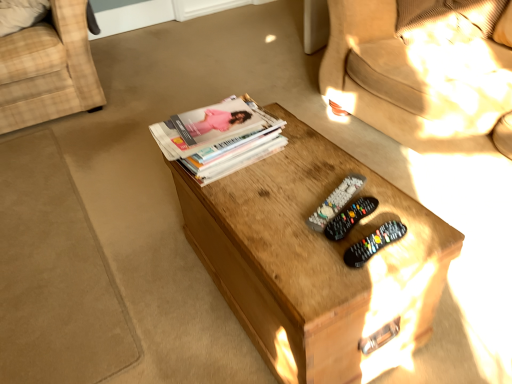
Image resolution: width=512 pixels, height=384 pixels. Identify the location of vacant area that lies to the right of white glossy magazine stack at center. (300, 150).